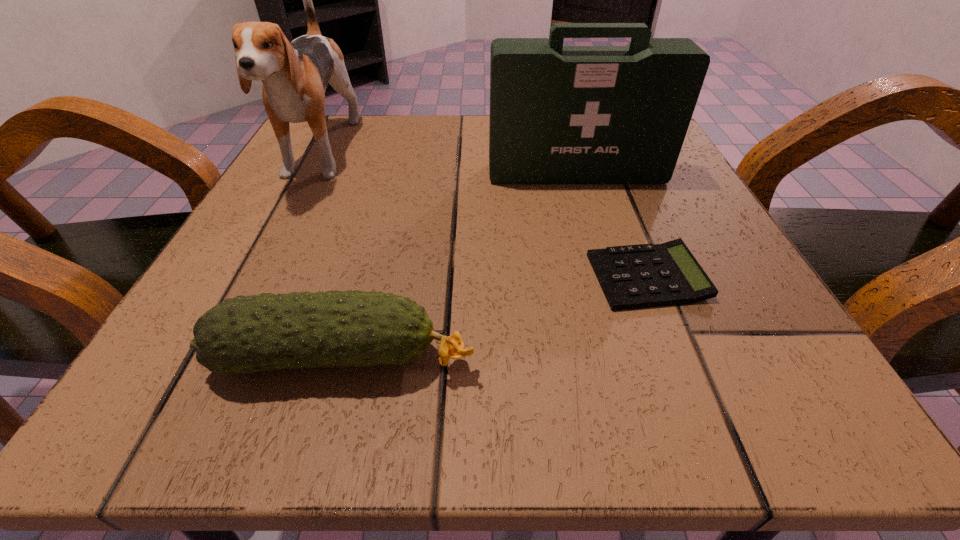
The image size is (960, 540). What are the coordinates of `vacant space at the far edge of the desktop` in the screenshot? It's located at (415, 150).

In the image, there is a desktop. Identify the location of free space at the near edge. (442, 394).

In the image, there is a desktop. Identify the location of vacant region at the left edge. This screenshot has width=960, height=540. pos(273,206).

This screenshot has width=960, height=540. I want to click on vacant area at the right edge of the desktop, so click(x=700, y=340).

I want to click on free space at the far left corner of the desktop, so click(352, 147).

This screenshot has height=540, width=960. What are the coordinates of `free spot at the near left corner of the desktop` in the screenshot? It's located at (272, 376).

Where is `empty space between the nearest object and the second tallest object`? empty space between the nearest object and the second tallest object is located at coordinates (461, 265).

You are a GUI agent. You are given a task and a screenshot of the screen. Output one action in this format:
    pyautogui.click(x=<x>, y=<y>)
    Task: Click on the free space between the shortest object and the third tallest object
    Image resolution: width=960 pixels, height=540 pixels.
    Given the screenshot: What is the action you would take?
    pyautogui.click(x=495, y=317)

You are a GUI agent. You are given a task and a screenshot of the screen. Output one action in this format:
    pyautogui.click(x=<x>, y=<y>)
    Task: Click on the empty location between the puppy and the calculator
    
    Given the screenshot: What is the action you would take?
    pyautogui.click(x=483, y=216)

Identify the location of vacant region between the cucumber and the shortest object. Image resolution: width=960 pixels, height=540 pixels. (495, 317).